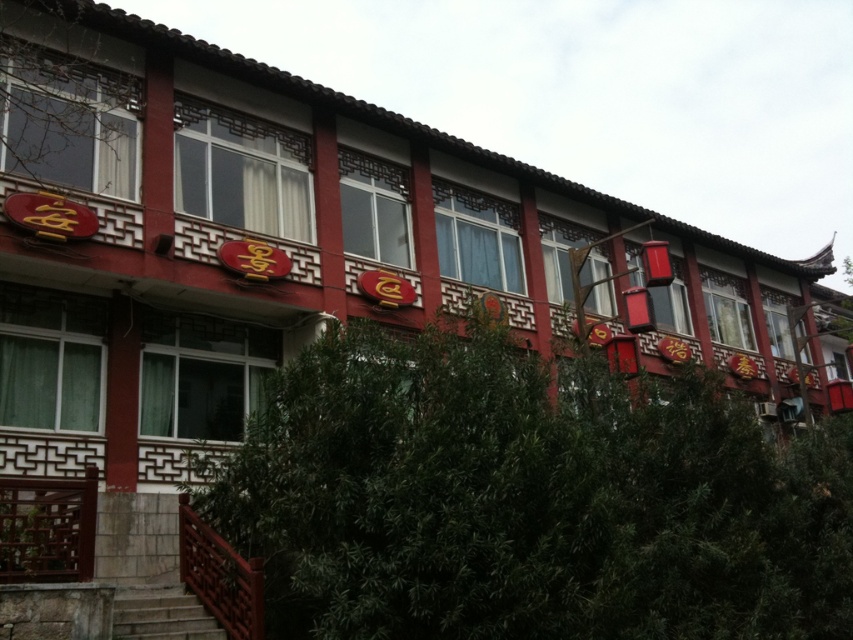
Question: Which point is farther from the camera taking this photo?

Choices:
 (A) (154, 572)
 (B) (489, 330)

Answer: (A)

Question: Can you confirm if green leafy tree at lower center is wider than wooden railing at lower left?

Choices:
 (A) no
 (B) yes

Answer: (A)

Question: Among these objects, which one is nearest to the camera?

Choices:
 (A) green leafy tree at lower center
 (B) wooden railing at lower left

Answer: (A)

Question: Is green leafy tree at lower center closer to camera compared to wooden railing at lower left?

Choices:
 (A) yes
 (B) no

Answer: (A)

Question: Can you confirm if green leafy tree at lower center is wider than wooden railing at lower left?

Choices:
 (A) yes
 (B) no

Answer: (B)

Question: Which point is closer to the camera?

Choices:
 (A) (22, 618)
 (B) (258, 449)

Answer: (A)